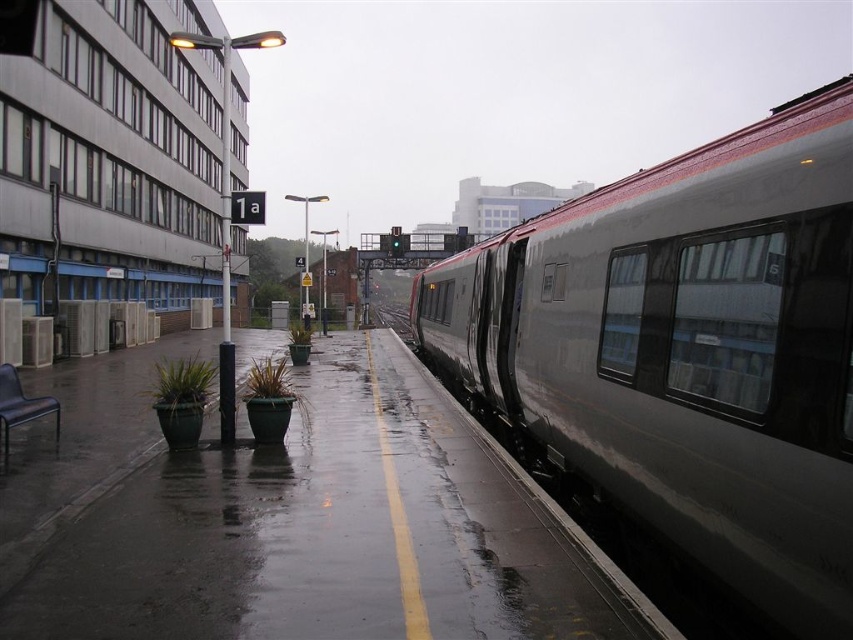
You are a train conductor who needs to know if the metallic gray train at right can safely approach the metal train track at center without overstepping the safety zone. The safety zone requires at least 50 feet of clearance. Can the train move forward?

The metallic gray train at right is 69.19 feet away from the metal train track at center, which is more than the required 50 feet clearance. Therefore, the metallic gray train at right can safely approach the metal train track at center without overstepping the safety zone.

You are a passenger waiting for the train on the platform. You notice the metallic gray train at right and the metal train track at center. Which object is shorter in height?

The metallic gray train at right has a lesser height compared to the metal train track at center, so the metallic gray train at right is shorter in height.